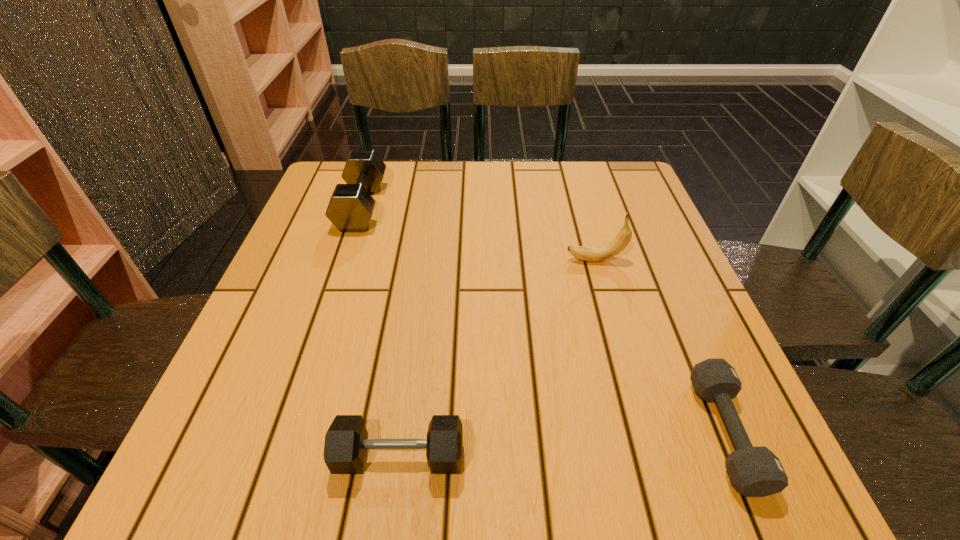
Identify the location of free region at the far edge of the desktop. The image size is (960, 540). (514, 208).

Identify the location of free space at the near edge of the desktop. This screenshot has height=540, width=960. (568, 464).

This screenshot has width=960, height=540. What are the coordinates of `free point at the left edge` in the screenshot? It's located at (290, 254).

Where is `free space at the right edge of the desktop`? The image size is (960, 540). free space at the right edge of the desktop is located at coordinates (639, 264).

Where is `vacant space at the near left corner`? vacant space at the near left corner is located at coordinates (267, 446).

Locate an element on the screen. free space between the farthest object and the second shortest object is located at coordinates (380, 331).

This screenshot has height=540, width=960. Identify the location of unoccupied position between the leftmost object and the second object from left to right. (380, 331).

Where is `vacant point located between the rightmost dumbbell and the third object from right to left`? The image size is (960, 540). vacant point located between the rightmost dumbbell and the third object from right to left is located at coordinates (563, 444).

Where is `free space between the third shortest object and the third object from left to right`? This screenshot has height=540, width=960. free space between the third shortest object and the third object from left to right is located at coordinates (478, 233).

Locate an element on the screen. Image resolution: width=960 pixels, height=540 pixels. free space between the shortest object and the third nearest object is located at coordinates (660, 346).